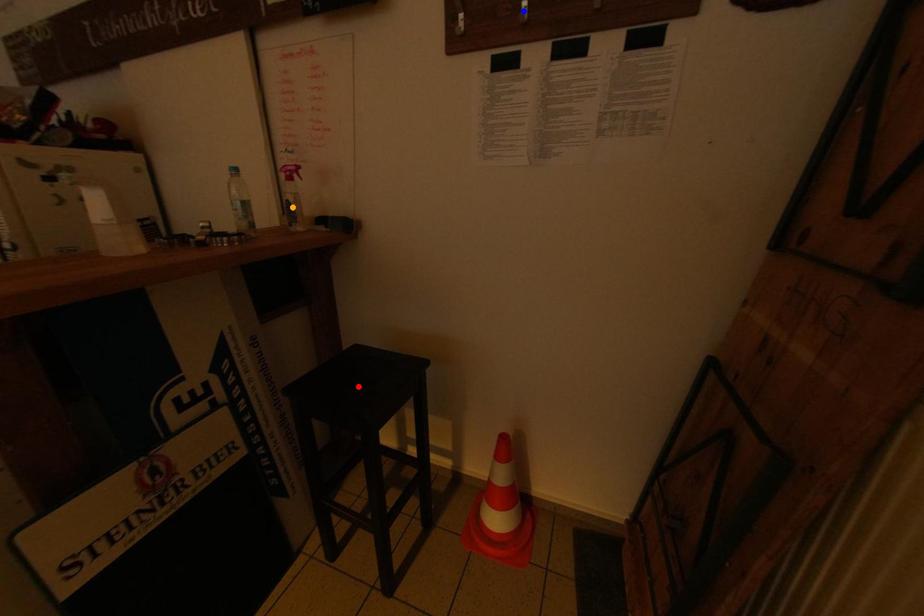
Order these from farthest to nearest:
red point
blue point
orange point

orange point, red point, blue point